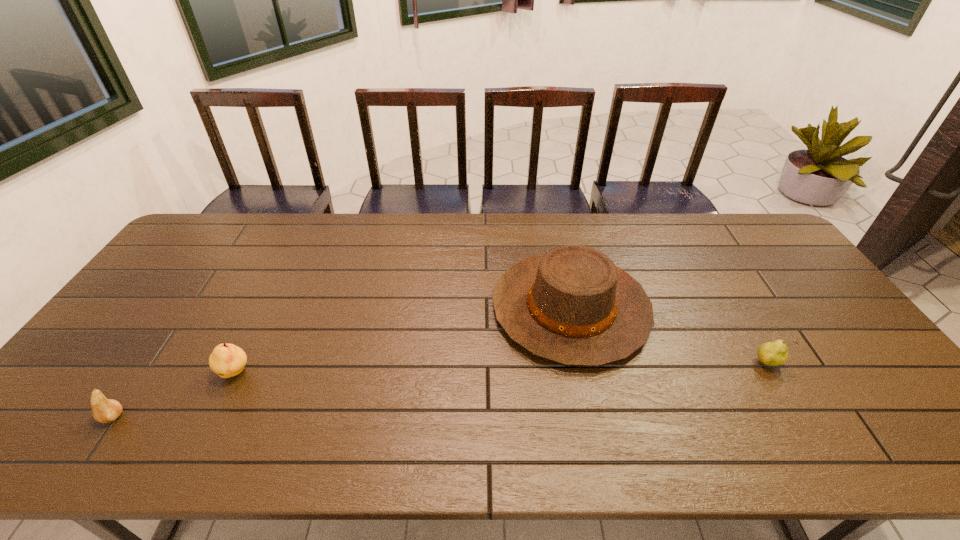
You are a GUI agent. You are given a task and a screenshot of the screen. Output one action in this format:
    pyautogui.click(x=<x>, y=<y>)
    Task: Click on the object located at the near edge
    This screenshot has width=960, height=540.
    Given the screenshot: What is the action you would take?
    pyautogui.click(x=104, y=410)

Find the location of a particular element. This screenshot has width=960, height=540. object at the left edge is located at coordinates pos(104,410).

You are a GUI agent. You are given a task and a screenshot of the screen. Output one action in this format:
    pyautogui.click(x=<x>, y=<y>)
    Task: Click on the object present at the near left corner
    This screenshot has width=960, height=540.
    Given the screenshot: What is the action you would take?
    pyautogui.click(x=104, y=410)

Image resolution: width=960 pixels, height=540 pixels. In order to click on vacant area at the far edge of the desktop in this screenshot , I will do `click(227, 252)`.

Locate an element on the screen. This screenshot has width=960, height=540. vacant space at the near edge of the desktop is located at coordinates (270, 455).

Locate an element on the screen. The height and width of the screenshot is (540, 960). vacant point at the left edge is located at coordinates (178, 265).

The width and height of the screenshot is (960, 540). Find the location of `free space at the right edge of the desktop`. free space at the right edge of the desktop is located at coordinates (780, 262).

Find the location of a particular element. vacant space at the near right corner is located at coordinates (924, 429).

Find the location of a particular element. Image resolution: width=960 pixels, height=540 pixels. free spot between the cowboy hat and the second object from left to right is located at coordinates (403, 341).

Find the location of a particular element. free space between the rightmost pear and the leftmost object is located at coordinates (440, 390).